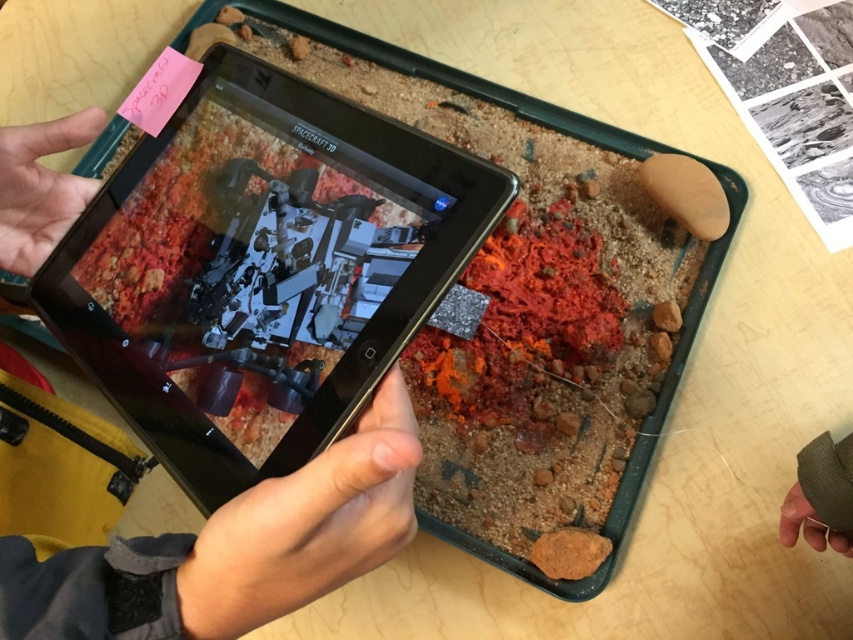
Is matte black tablet at center positioned before matte skin hand at upper left?

Yes, it is in front of matte skin hand at upper left.

Describe the element at coordinates (306, 525) in the screenshot. The image size is (853, 640). I see `matte black tablet at center` at that location.

Find the location of a particular element. The width and height of the screenshot is (853, 640). matte black tablet at center is located at coordinates (306, 525).

Can you confirm if matte skin hand at upper left is wider than textured gray glove at lower right?

Yes, matte skin hand at upper left is wider than textured gray glove at lower right.

Can you confirm if matte skin hand at upper left is positioned to the left of textured gray glove at lower right?

Yes, matte skin hand at upper left is to the left of textured gray glove at lower right.

Between point (22, 208) and point (851, 512), which one is positioned behind?

Point (22, 208)

Identify the location of matte skin hand at upper left. (39, 188).

This screenshot has height=640, width=853. I want to click on black glossy tablet at center, so click(x=260, y=269).

Can you confirm if black glossy tablet at center is taller than matte skin hand at upper left?

Indeed, black glossy tablet at center has a greater height compared to matte skin hand at upper left.

Which is behind, point (273, 328) or point (26, 275)?

The point (26, 275) is behind.

Where is `black glossy tablet at center`? This screenshot has height=640, width=853. black glossy tablet at center is located at coordinates (260, 269).